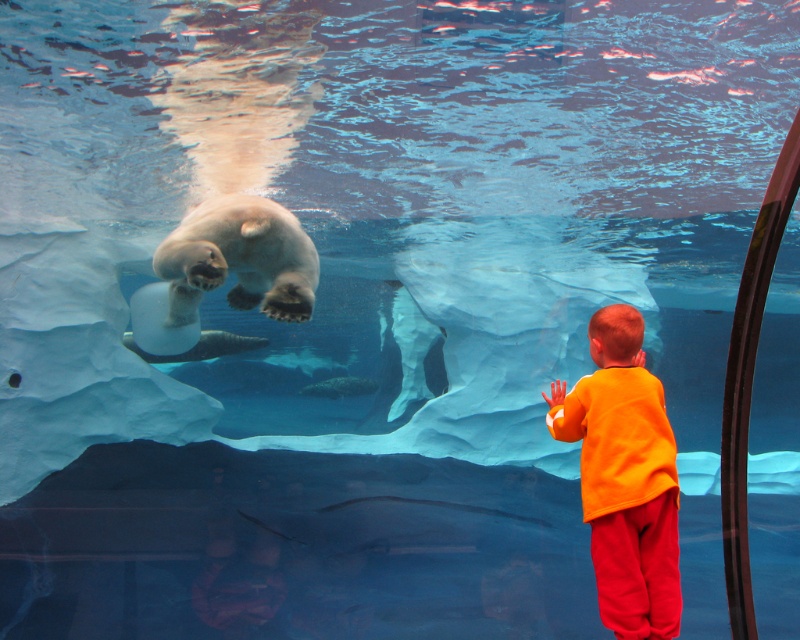
Question: Does orange cotton shirt at lower right come in front of white matte polar bear at upper center?

Choices:
 (A) no
 (B) yes

Answer: (B)

Question: Which point appears closest to the camera in this image?

Choices:
 (A) (620, 467)
 (B) (292, 256)

Answer: (A)

Question: Is orange cotton shirt at lower right further to camera compared to white matte polar bear at upper center?

Choices:
 (A) yes
 (B) no

Answer: (B)

Question: Which of the following is the farthest from the observer?

Choices:
 (A) white matte polar bear at upper center
 (B) orange cotton shirt at lower right

Answer: (A)

Question: Does orange cotton shirt at lower right lie behind white matte polar bear at upper center?

Choices:
 (A) yes
 (B) no

Answer: (B)